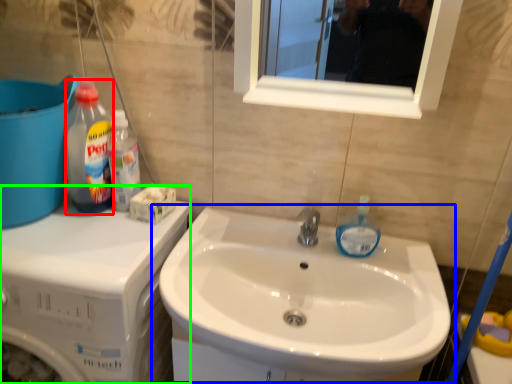
Question: Which is farther away from cleaning product (highlighted by a red box)? sink (highlighted by a blue box) or dish washer (highlighted by a green box)?

Choices:
 (A) sink
 (B) dish washer

Answer: (A)